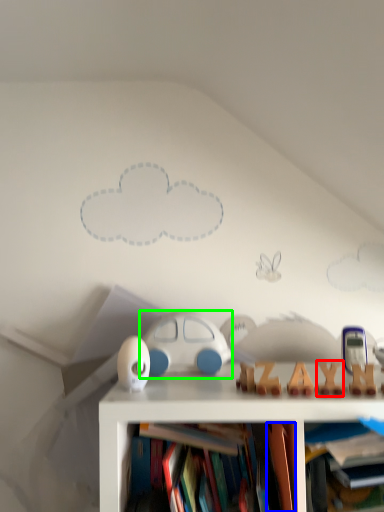
Question: Based on their relative distances, which object is nearer to toy (highlighted by a red box)? Choose from book (highlighted by a blue box) and toy (highlighted by a green box).

Choices:
 (A) book
 (B) toy

Answer: (A)